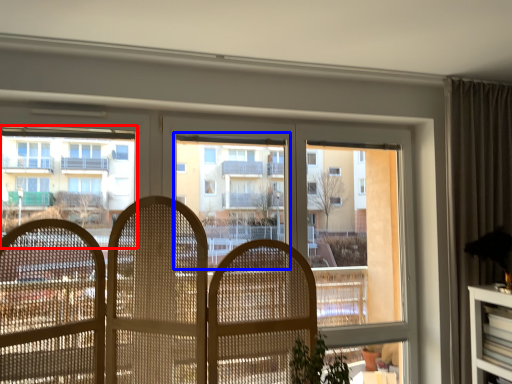
Question: Which object is further to the camera taking this photo, condominium (highlighted by a red box) or bay window (highlighted by a blue box)?

Choices:
 (A) condominium
 (B) bay window

Answer: (B)